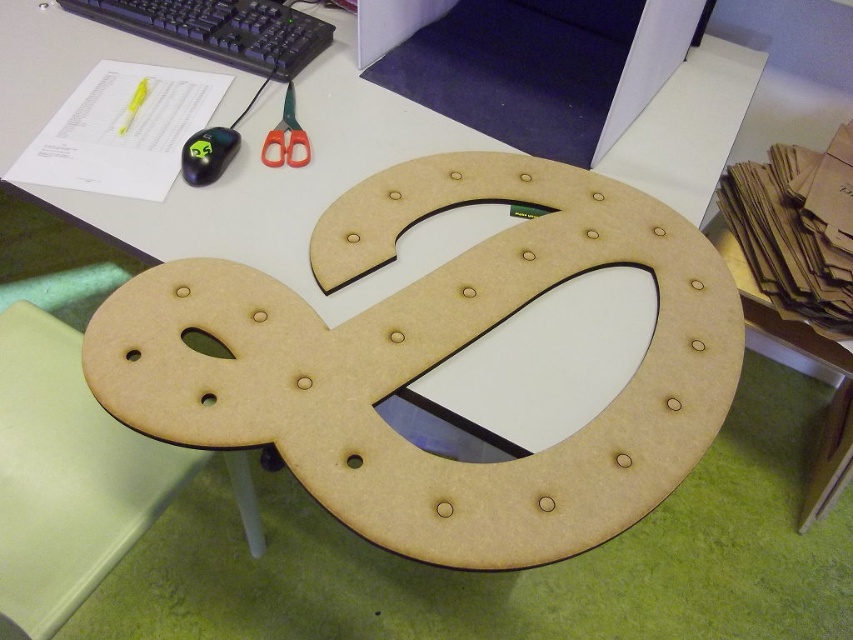
What do you see at coordinates (219, 29) in the screenshot? I see `black plastic keyboard at upper left` at bounding box center [219, 29].

Between black plastic keyboard at upper left and green plastic scissors at upper center, which one appears on the right side from the viewer's perspective?

Positioned to the right is green plastic scissors at upper center.

Is point (293, 52) less distant than point (297, 134)?

No.

What are the coordinates of `black plastic keyboard at upper left` in the screenshot? It's located at (219, 29).

Which is more to the left, black plastic keyboard at upper left or yellow plastic highlighter at upper left?

Positioned to the left is yellow plastic highlighter at upper left.

Measure the distance between black plastic keyboard at upper left and yellow plastic highlighter at upper left.

A distance of 7.22 inches exists between black plastic keyboard at upper left and yellow plastic highlighter at upper left.

Does point (196, 49) come closer to viewer compared to point (120, 131)?

No, (196, 49) is behind (120, 131).

This screenshot has height=640, width=853. I want to click on black plastic keyboard at upper left, so click(219, 29).

Is green plastic scissors at upper center behind yellow plastic highlighter at upper left?

That is False.

Is green plastic scissors at upper center to the left of yellow plastic highlighter at upper left from the viewer's perspective?

In fact, green plastic scissors at upper center is to the right of yellow plastic highlighter at upper left.

In order to click on green plastic scissors at upper center in this screenshot , I will do `click(286, 138)`.